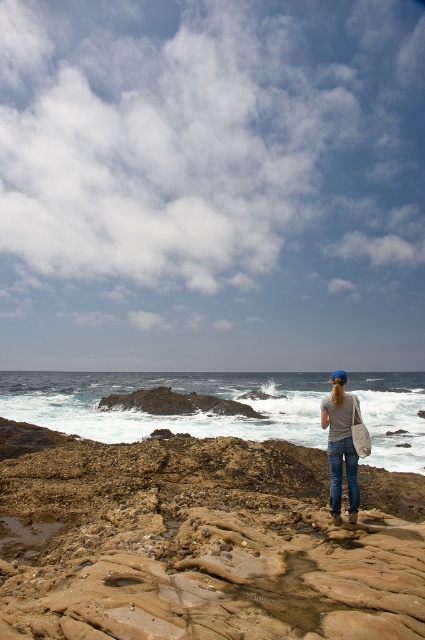
Describe the element at coordinates (200, 541) in the screenshot. Image resolution: width=425 pixels, height=640 pixels. I see `brown rock at center` at that location.

Can you confirm if brown rock at center is shorter than gray cotton shirt at center?

Correct, brown rock at center is not as tall as gray cotton shirt at center.

What are the coordinates of `brown rock at center` in the screenshot? It's located at (200, 541).

Which is behind, point (214, 419) or point (329, 452)?

Point (214, 419)

Does white foamy water at center come behind gray cotton shirt at center?

No, white foamy water at center is closer to the viewer.

Is point (238, 394) positioned before point (334, 493)?

No, it is behind (334, 493).

Locate an element on the screen. The image size is (425, 640). white foamy water at center is located at coordinates (163, 413).

Does white foamy water at center have a greater height compared to blue denim jeans at center?

Yes.

In the scene shown: Does white foamy water at center appear on the right side of blue denim jeans at center?

In fact, white foamy water at center is to the left of blue denim jeans at center.

Between point (323, 376) and point (351, 464), which one is positioned behind?

Point (323, 376)

You are a GUI agent. You are given a task and a screenshot of the screen. Output one action in this format:
    pyautogui.click(x=<x>, y=<y>)
    Task: Click on the white foamy water at center
    
    Given the screenshot: What is the action you would take?
    pyautogui.click(x=163, y=413)